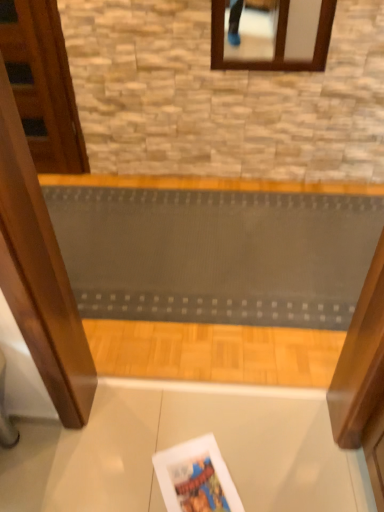
Question: From their relative heights in the image, would you say textured gray ramp at center is taller or shorter than wooden door at left?

Choices:
 (A) tall
 (B) short

Answer: (B)

Question: From the image's perspective, relative to wooden door at left, is textured gray ramp at center above or below?

Choices:
 (A) above
 (B) below

Answer: (B)

Question: Which is nearer to the textured gray ramp at center?

Choices:
 (A) matte paper magazine at lower center
 (B) wooden door at left

Answer: (B)

Question: Which of these objects is positioned farthest from the wooden door at left?

Choices:
 (A) matte paper magazine at lower center
 (B) textured gray ramp at center

Answer: (A)